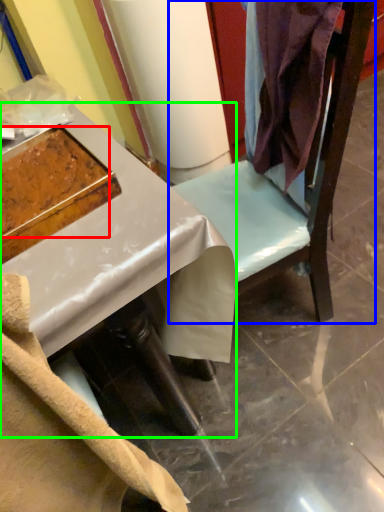
Question: Which object is positioned farthest from food (highlighted by a red box)? Select from furniture (highlighted by a blue box) and desk (highlighted by a green box).

Choices:
 (A) furniture
 (B) desk

Answer: (A)